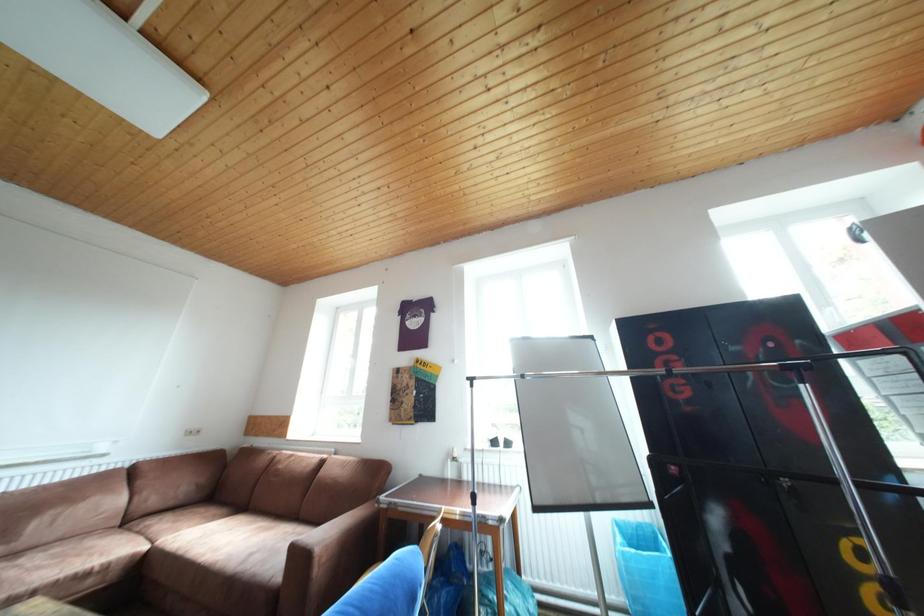
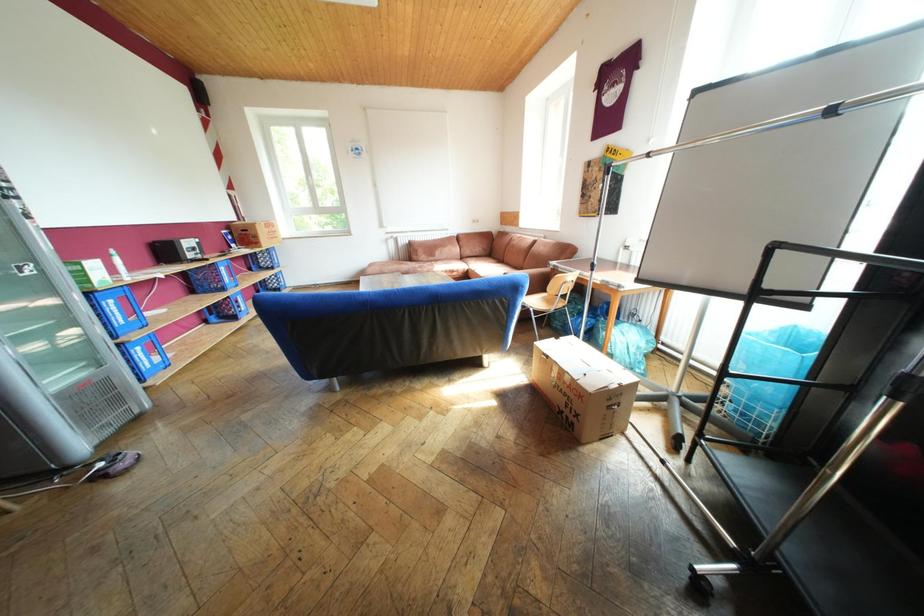
From the picture: The first image is from the beginning of the video and the second image is from the end. How did the camera likely rotate when shooting the video?

The camera's rotation is toward left-down.